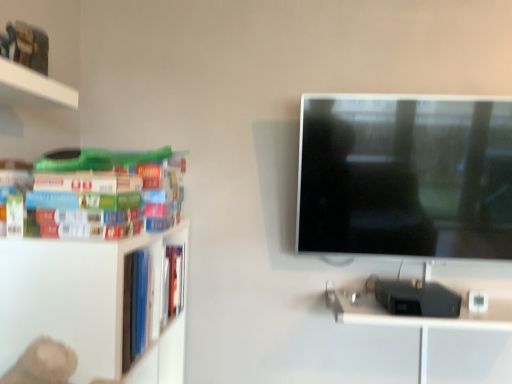
Question: Can you confirm if hardcover books at left is taller than metallic silver computer desk at lower right?

Choices:
 (A) yes
 (B) no

Answer: (A)

Question: Can you confirm if hardcover books at left is smaller than metallic silver computer desk at lower right?

Choices:
 (A) no
 (B) yes

Answer: (B)

Question: From the image's perspective, would you say hardcover books at left is shown under metallic silver computer desk at lower right?

Choices:
 (A) no
 (B) yes

Answer: (A)

Question: Can you confirm if hardcover books at left is wider than metallic silver computer desk at lower right?

Choices:
 (A) yes
 (B) no

Answer: (B)

Question: Is hardcover books at left touching metallic silver computer desk at lower right?

Choices:
 (A) yes
 (B) no

Answer: (B)

Question: Does hardcover books at left have a lesser width compared to metallic silver computer desk at lower right?

Choices:
 (A) no
 (B) yes

Answer: (B)

Question: Does metallic silver computer desk at lower right lie in front of hardcover books at left?

Choices:
 (A) no
 (B) yes

Answer: (A)

Question: From a real-world perspective, is metallic silver computer desk at lower right beneath hardcover books at left?

Choices:
 (A) yes
 (B) no

Answer: (A)

Question: Is metallic silver computer desk at lower right next to hardcover books at left?

Choices:
 (A) yes
 (B) no

Answer: (B)

Question: Can you confirm if metallic silver computer desk at lower right is taller than hardcover books at left?

Choices:
 (A) yes
 (B) no

Answer: (B)

Question: Is metallic silver computer desk at lower right far from hardcover books at left?

Choices:
 (A) yes
 (B) no

Answer: (B)

Question: Is metallic silver computer desk at lower right positioned behind hardcover books at left?

Choices:
 (A) yes
 (B) no

Answer: (A)

Question: Which is correct: metallic silver computer desk at lower right is inside hardcover books at left, or outside of it?

Choices:
 (A) outside
 (B) inside

Answer: (A)